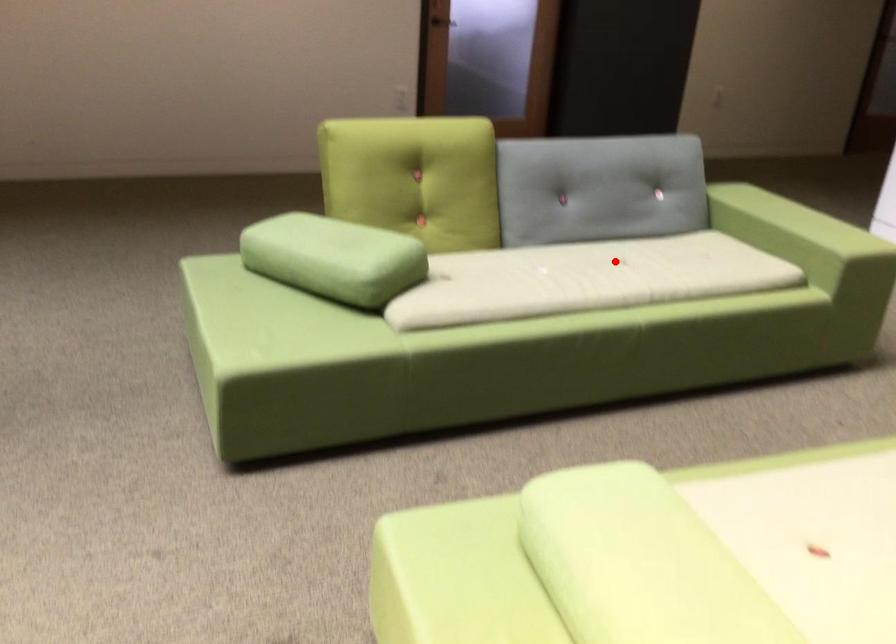
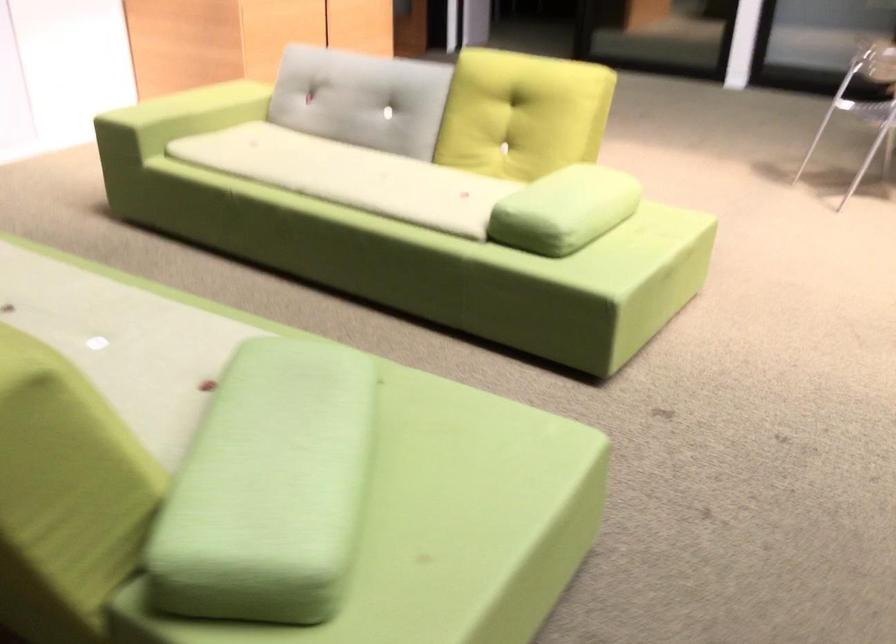
Question: I am providing you with two images of the same scene from different viewpoints. A red point is marked on the first image. At the location where the point appears in image 1, is it still visible in image 2?

Choices:
 (A) Yes
 (B) No

Answer: (A)